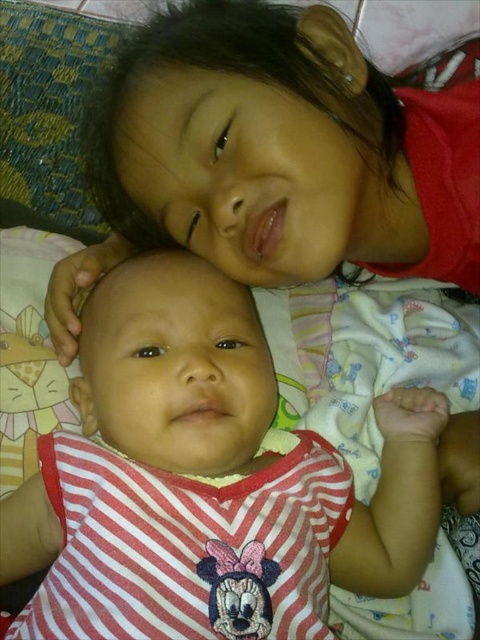
Between point (239, 474) and point (462, 209), which one is positioned behind?

The point (462, 209) is more distant.

Identify the location of red striped fabric at center. This screenshot has width=480, height=640. (205, 481).

Where is `red striped fabric at center`? This screenshot has height=640, width=480. red striped fabric at center is located at coordinates (205, 481).